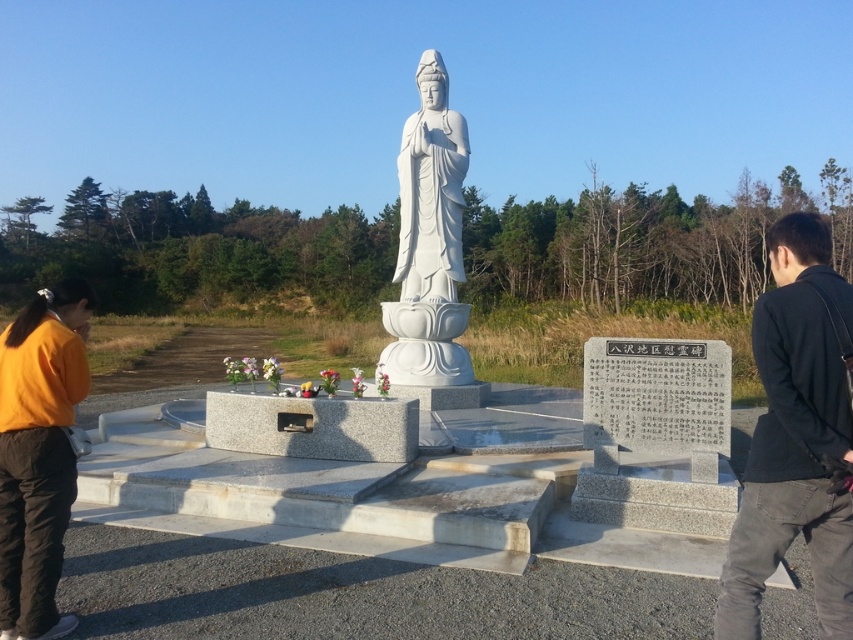
Question: Is black cotton jacket at right above orange fabric at lower left?

Choices:
 (A) yes
 (B) no

Answer: (B)

Question: Observing the image, what is the correct spatial positioning of orange fabric at lower left in reference to white marble statue at center?

Choices:
 (A) above
 (B) below

Answer: (B)

Question: Where is black cotton jacket at right located in relation to white marble statue at center in the image?

Choices:
 (A) left
 (B) right

Answer: (B)

Question: Among these objects, which one is nearest to the camera?

Choices:
 (A) white marble statue at center
 (B) orange fabric at lower left

Answer: (B)

Question: Which is nearer to the orange fabric at lower left?

Choices:
 (A) black cotton jacket at right
 (B) white marble statue at center

Answer: (A)

Question: Among these objects, which one is nearest to the camera?

Choices:
 (A) orange fabric at lower left
 (B) black cotton jacket at right
 (C) white marble statue at center

Answer: (B)